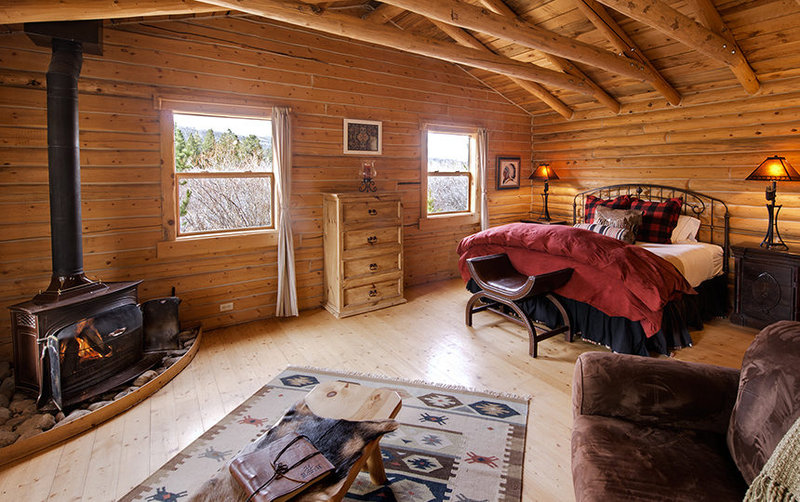
The width and height of the screenshot is (800, 502). In order to click on lampshades in this screenshot , I will do `click(544, 172)`, `click(766, 170)`.